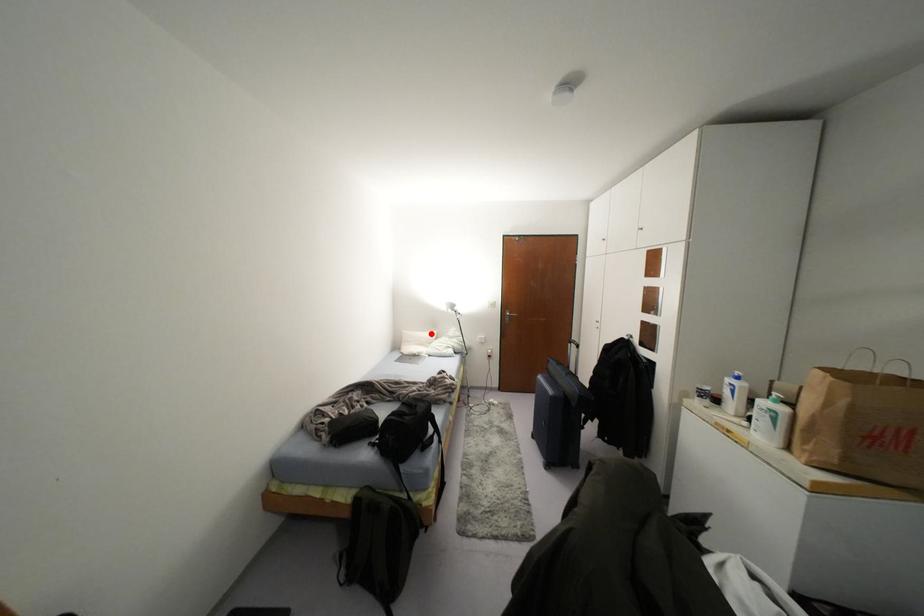
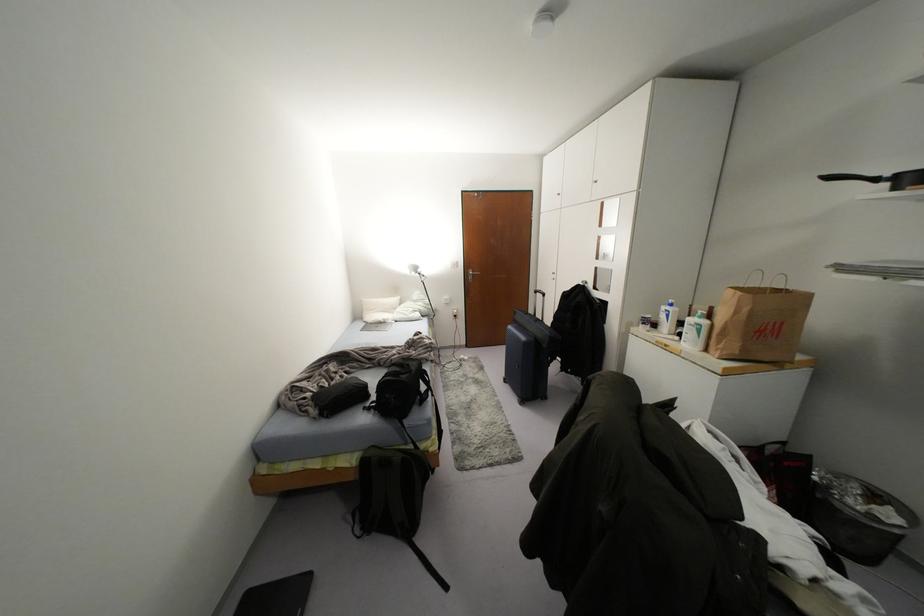
In the second image, find the point that corresponds to the highlighted location in the first image.

(394, 299)